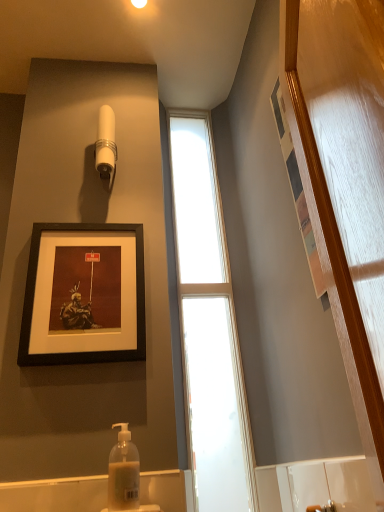
Measure the distance between matte black frame at upper center and camera.

matte black frame at upper center is 1.16 meters from camera.

Describe the element at coordinates (84, 295) in the screenshot. I see `matte black frame at upper center` at that location.

The width and height of the screenshot is (384, 512). What do you see at coordinates (209, 326) in the screenshot?
I see `clear glass window at center` at bounding box center [209, 326].

Locate an element on the screen. This screenshot has width=384, height=512. white plastic shower head at upper center is located at coordinates (106, 145).

You are a GUI agent. You are given a task and a screenshot of the screen. Output one action in this format:
    pyautogui.click(x=<x>, y=<y>)
    Task: Click on the picture frame on the left of white plastic shower head at upper center
    Image resolution: width=384 pixels, height=512 pixels.
    Given the screenshot: What is the action you would take?
    pyautogui.click(x=84, y=295)

Is white plastic shower head at upper center located outside matte black frame at upper center?

Absolutely, white plastic shower head at upper center is external to matte black frame at upper center.

From the image's perspective, does white plastic shower head at upper center appear lower than matte black frame at upper center?

Actually, white plastic shower head at upper center appears above matte black frame at upper center in the image.

From a real-world perspective, relative to matte black frame at upper center, is white plastic shower head at upper center vertically above or below?

Clearly, from a real-world perspective, white plastic shower head at upper center is above matte black frame at upper center.

From the image's perspective, which is above, translucent plastic soap dispenser at lower center or matte black frame at upper center?

matte black frame at upper center appears higher in the image.

Can you tell me how much translucent plastic soap dispenser at lower center and matte black frame at upper center differ in facing direction?

There is a 2.34-degree angle between the facing directions of translucent plastic soap dispenser at lower center and matte black frame at upper center.

Does translucent plastic soap dispenser at lower center turn towards matte black frame at upper center?

No.

From the image's perspective, is matte black frame at upper center over white plastic shower head at upper center?

Actually, matte black frame at upper center appears below white plastic shower head at upper center in the image.

Which of these two, matte black frame at upper center or white plastic shower head at upper center, is smaller?

With smaller size is white plastic shower head at upper center.

From a real-world perspective, which object rests below the other?

matte black frame at upper center, from a real-world perspective.

Is matte black frame at upper center positioned far away from white plastic shower head at upper center?

No, matte black frame at upper center is not far away from white plastic shower head at upper center.

Based on the photo, how far apart are white plastic shower head at upper center and clear glass window at center?

white plastic shower head at upper center is 23.03 inches away from clear glass window at center.

Consider the image. From a real-world perspective, which is physically above, white plastic shower head at upper center or clear glass window at center?

From a 3D spatial view, white plastic shower head at upper center is above.

Where is `window below the white plastic shower head at upper center (from the image's perspective)`? The image size is (384, 512). window below the white plastic shower head at upper center (from the image's perspective) is located at coordinates pos(209,326).

Considering the sizes of objects white plastic shower head at upper center and translucent plastic soap dispenser at lower center in the image provided, who is bigger, white plastic shower head at upper center or translucent plastic soap dispenser at lower center?

white plastic shower head at upper center.

Is point (111, 186) less distant than point (135, 506)?

No, it is behind (135, 506).

Can you see white plastic shower head at upper center touching translucent plastic soap dispenser at lower center?

No, white plastic shower head at upper center is not beside translucent plastic soap dispenser at lower center.

From a real-world perspective, is white plastic shower head at upper center positioned under translucent plastic soap dispenser at lower center based on gravity?

No, from a real-world perspective, white plastic shower head at upper center is not beneath translucent plastic soap dispenser at lower center.

From a real-world perspective, is translucent plastic soap dispenser at lower center above or below white plastic shower head at upper center?

From a real-world perspective, translucent plastic soap dispenser at lower center is physically below white plastic shower head at upper center.

Is translucent plastic soap dispenser at lower center taller or shorter than white plastic shower head at upper center?

Considering their sizes, translucent plastic soap dispenser at lower center has less height than white plastic shower head at upper center.

Would you say white plastic shower head at upper center is part of translucent plastic soap dispenser at lower center's contents?

No, white plastic shower head at upper center is not surrounded by translucent plastic soap dispenser at lower center.

In the image, there is a translucent plastic soap dispenser at lower center. Find the location of `shower above it (from the image's perspective)`. shower above it (from the image's perspective) is located at coordinates (106, 145).

Would you say matte black frame at upper center is outside clear glass window at center?

matte black frame at upper center is positioned outside clear glass window at center.

Measure the distance from matte black frame at upper center to clear glass window at center.

matte black frame at upper center and clear glass window at center are 17.51 inches apart from each other.

Is matte black frame at upper center thinner than clear glass window at center?

Yes.

Does matte black frame at upper center lie in front of clear glass window at center?

Yes, it is.

The image size is (384, 512). In order to click on picture frame below the white plastic shower head at upper center (from the image's perspective) in this screenshot , I will do `click(84, 295)`.

Find the location of a particular element. Image resolution: width=384 pixels, height=512 pixels. picture frame on the left of translucent plastic soap dispenser at lower center is located at coordinates (84, 295).

When comparing their distances from translucent plastic soap dispenser at lower center, does white plastic shower head at upper center or matte black frame at upper center seem closer?

matte black frame at upper center is closer to translucent plastic soap dispenser at lower center.

From the image, which object appears to be nearer to clear glass window at center, white plastic shower head at upper center or translucent plastic soap dispenser at lower center?

Among the two, translucent plastic soap dispenser at lower center is located nearer to clear glass window at center.

Which object lies further to the anchor point white plastic shower head at upper center, translucent plastic soap dispenser at lower center or matte black frame at upper center?

translucent plastic soap dispenser at lower center is positioned further to the anchor white plastic shower head at upper center.

Considering their positions, is clear glass window at center positioned further to white plastic shower head at upper center than matte black frame at upper center?

Among the two, clear glass window at center is located further to white plastic shower head at upper center.

Estimate the real-world distances between objects in this image. Which object is closer to matte black frame at upper center, white plastic shower head at upper center or clear glass window at center?

Among the two, white plastic shower head at upper center is located nearer to matte black frame at upper center.

Which object lies nearer to the anchor point white plastic shower head at upper center, translucent plastic soap dispenser at lower center or clear glass window at center?

clear glass window at center.

When comparing their distances from white plastic shower head at upper center, does clear glass window at center or translucent plastic soap dispenser at lower center seem further?

translucent plastic soap dispenser at lower center lies further to white plastic shower head at upper center than the other object.

Looking at this image, when comparing their distances from clear glass window at center, does matte black frame at upper center or white plastic shower head at upper center seem closer?

matte black frame at upper center lies closer to clear glass window at center than the other object.

The image size is (384, 512). Identify the location of window between white plastic shower head at upper center and translucent plastic soap dispenser at lower center from top to bottom. (209, 326).

Image resolution: width=384 pixels, height=512 pixels. Find the location of `picture frame between white plastic shower head at upper center and translucent plastic soap dispenser at lower center from top to bottom`. picture frame between white plastic shower head at upper center and translucent plastic soap dispenser at lower center from top to bottom is located at coordinates (84, 295).

Find the location of `picture frame between clear glass window at center and translucent plastic soap dispenser at lower center vertically`. picture frame between clear glass window at center and translucent plastic soap dispenser at lower center vertically is located at coordinates (84, 295).

You are a GUI agent. You are given a task and a screenshot of the screen. Output one action in this format:
    pyautogui.click(x=<x>, y=<y>)
    Task: Click on the window between white plastic shower head at upper center and matte black frame at upper center from top to bottom
    This screenshot has height=512, width=384.
    Given the screenshot: What is the action you would take?
    pyautogui.click(x=209, y=326)